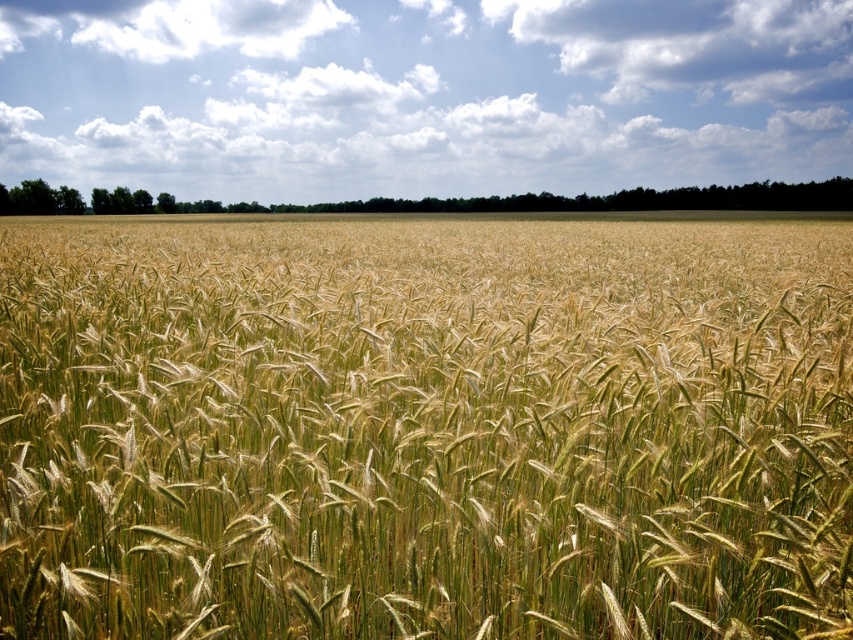
Who is lower down, green grassy wheat at center or white fluffy clouds at upper center?

green grassy wheat at center

Is green grassy wheat at center behind white fluffy clouds at upper center?

No.

Identify the location of green grassy wheat at center. Image resolution: width=853 pixels, height=640 pixels. (426, 426).

Image resolution: width=853 pixels, height=640 pixels. In order to click on green grassy wheat at center in this screenshot , I will do `click(426, 426)`.